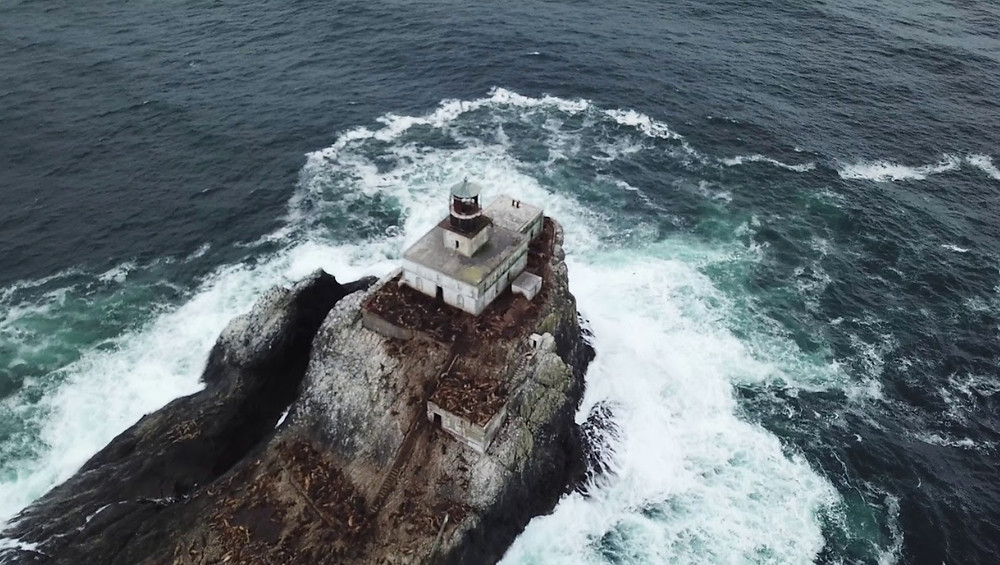
You are a GUI agent. You are given a task and a screenshot of the screen. Output one action in this format:
    pyautogui.click(x=<x>, y=<y>)
    Task: Click on the staircase
    
    Given the screenshot: What is the action you would take?
    pyautogui.click(x=385, y=490), pyautogui.click(x=407, y=454), pyautogui.click(x=439, y=373), pyautogui.click(x=447, y=362)